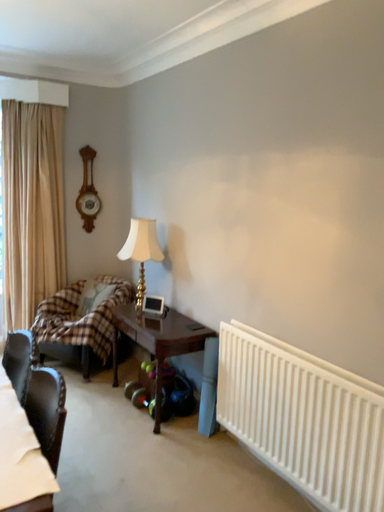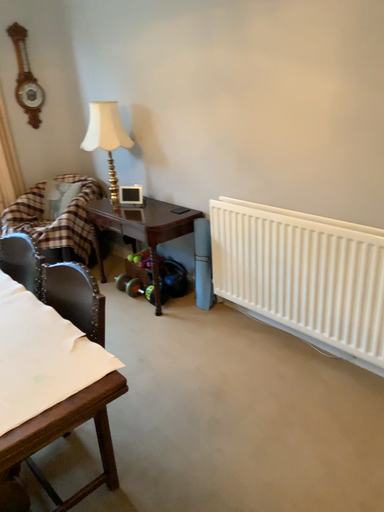
Question: How did the camera likely rotate when shooting the video?

Choices:
 (A) rotated downward
 (B) rotated upward

Answer: (A)